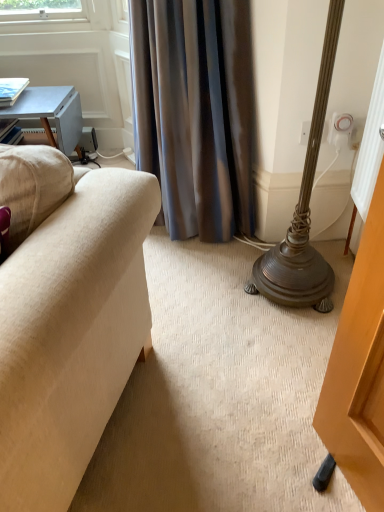
Where is `silky gray curtain at center`? silky gray curtain at center is located at coordinates (195, 112).

Which object is further away from the camera taking this photo, light blue wooden table at upper left or silky gray curtain at center?

light blue wooden table at upper left.

Is light blue wooden table at upper left positioned beyond the bounds of silky gray curtain at center?

That's correct, light blue wooden table at upper left is outside of silky gray curtain at center.

Between light blue wooden table at upper left and silky gray curtain at center, which one has smaller size?

light blue wooden table at upper left is smaller.

From the image's perspective, which is below, light blue wooden table at upper left or silky gray curtain at center?

From the image's view, silky gray curtain at center is below.

From a real-world perspective, who is located higher, white plastic electric outlet at upper right or silky gray curtain at center?

white plastic electric outlet at upper right is physically above.

Where is `electric outlet to the right of silky gray curtain at center`? This screenshot has height=512, width=384. electric outlet to the right of silky gray curtain at center is located at coordinates (340, 130).

Is white plastic electric outlet at upper right completely or partially outside of silky gray curtain at center?

Yes.

Is white plastic electric outlet at upper right far away from silky gray curtain at center?

No, white plastic electric outlet at upper right is not far from silky gray curtain at center.

Is point (339, 148) farther from camera compared to point (54, 99)?

That is False.

Does white plastic electric outlet at upper right turn towards light blue wooden table at upper left?

No, white plastic electric outlet at upper right does not turn towards light blue wooden table at upper left.

Considering their positions, is white plastic electric outlet at upper right located in front of or behind light blue wooden table at upper left?

white plastic electric outlet at upper right is in front of light blue wooden table at upper left.

Is white plastic electric outlet at upper right to the left of light blue wooden table at upper left from the viewer's perspective?

No, white plastic electric outlet at upper right is not to the left of light blue wooden table at upper left.

Does silky gray curtain at center lie in front of white plastic electric outlet at upper right?

Yes, it is.

Considering the positions of objects silky gray curtain at center and white plastic electric outlet at upper right in the image provided, who is more to the left, silky gray curtain at center or white plastic electric outlet at upper right?

Positioned to the left is silky gray curtain at center.

Is point (238, 149) closer to viewer compared to point (341, 147)?

No.

Can you confirm if silky gray curtain at center is thinner than white plastic electric outlet at upper right?

Incorrect, the width of silky gray curtain at center is not less than that of white plastic electric outlet at upper right.

Considering the relative sizes of light blue wooden table at upper left and white plastic electric outlet at upper right in the image provided, is light blue wooden table at upper left taller than white plastic electric outlet at upper right?

Yes.

Which object is wider, light blue wooden table at upper left or white plastic electric outlet at upper right?

Wider between the two is light blue wooden table at upper left.

Based on the photo, which object is more forward, light blue wooden table at upper left or white plastic electric outlet at upper right?

white plastic electric outlet at upper right is closer to the camera.

Are light blue wooden table at upper left and white plastic electric outlet at upper right making contact?

No, light blue wooden table at upper left is not in contact with white plastic electric outlet at upper right.

Is silky gray curtain at center oriented towards light blue wooden table at upper left?

No, silky gray curtain at center is not turned towards light blue wooden table at upper left.

Locate an element on the screen. The image size is (384, 512). table beneath the silky gray curtain at center (from a real-world perspective) is located at coordinates (51, 113).

In the scene shown: How far apart are silky gray curtain at center and light blue wooden table at upper left?

silky gray curtain at center is 78.57 centimeters from light blue wooden table at upper left.

The width and height of the screenshot is (384, 512). Find the location of `curtain in front of the light blue wooden table at upper left`. curtain in front of the light blue wooden table at upper left is located at coordinates (195, 112).

The image size is (384, 512). I want to click on curtain on the left side of white plastic electric outlet at upper right, so click(x=195, y=112).

Looking at the image, which one is located further to silky gray curtain at center, light blue wooden table at upper left or white plastic electric outlet at upper right?

light blue wooden table at upper left is further to silky gray curtain at center.

From the image, which object appears to be farther from white plastic electric outlet at upper right, silky gray curtain at center or light blue wooden table at upper left?

light blue wooden table at upper left.

From the image, which object appears to be nearer to white plastic electric outlet at upper right, light blue wooden table at upper left or silky gray curtain at center?

silky gray curtain at center is positioned closer to the anchor white plastic electric outlet at upper right.

Which object lies nearer to the anchor point light blue wooden table at upper left, white plastic electric outlet at upper right or silky gray curtain at center?

Based on the image, silky gray curtain at center appears to be nearer to light blue wooden table at upper left.

From the image, which object appears to be farther from silky gray curtain at center, white plastic electric outlet at upper right or light blue wooden table at upper left?

Based on the image, light blue wooden table at upper left appears to be further to silky gray curtain at center.

Which object lies further to the anchor point light blue wooden table at upper left, silky gray curtain at center or white plastic electric outlet at upper right?

white plastic electric outlet at upper right is further to light blue wooden table at upper left.

This screenshot has width=384, height=512. What are the coordinates of `curtain located between light blue wooden table at upper left and white plastic electric outlet at upper right in the left-right direction` in the screenshot? It's located at (195, 112).